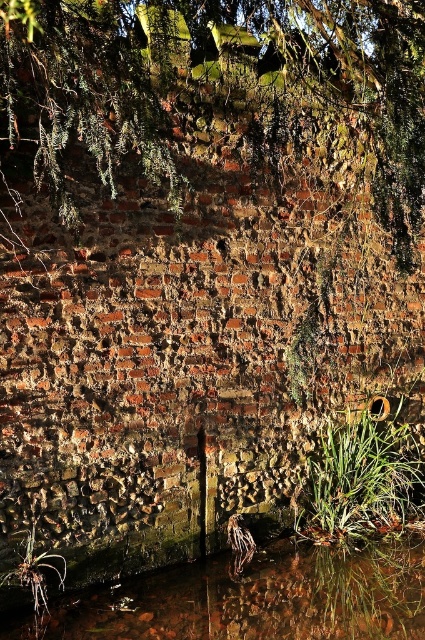
Who is lower down, green leafy tree at upper center or green fibrous weed at lower left?

green fibrous weed at lower left

What do you see at coordinates (212, 83) in the screenshot?
I see `green leafy tree at upper center` at bounding box center [212, 83].

Which is in front, point (169, 36) or point (27, 536)?

Point (27, 536) is more forward.

This screenshot has width=425, height=640. What are the coordinates of `green leafy tree at upper center` in the screenshot? It's located at (212, 83).

Image resolution: width=425 pixels, height=640 pixels. Describe the element at coordinates (212, 83) in the screenshot. I see `green leafy tree at upper center` at that location.

Is green leafy tree at upper center further to the viewer compared to brown/rough water at lower center?

No.

What do you see at coordinates (212, 83) in the screenshot? The height and width of the screenshot is (640, 425). I see `green leafy tree at upper center` at bounding box center [212, 83].

This screenshot has height=640, width=425. I want to click on green leafy tree at upper center, so 212,83.

From the picture: Is brown/rough water at lower center further to the viewer compared to green fibrous weed at lower left?

No.

Is brown/rough water at lower center below green fibrous weed at lower left?

Yes.

At what (x,y) coordinates should I click in order to perform the action: click on brown/rough water at lower center. Please return your answer as a coordinate pair (x, y). The image size is (425, 640). Looking at the image, I should click on (252, 598).